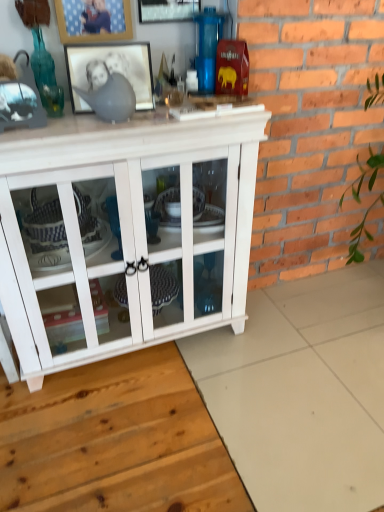
Question: From a real-world perspective, is metallic silver picture frame at upper center, which appears as the 1th picture frame when viewed from the top, positioned over white wood cabinet at center based on gravity?

Choices:
 (A) yes
 (B) no

Answer: (A)

Question: Considering the relative sizes of metallic silver picture frame at upper center, which appears as the 1th picture frame when viewed from the top, and white wood cabinet at center in the image provided, is metallic silver picture frame at upper center, which appears as the 1th picture frame when viewed from the top, taller than white wood cabinet at center?

Choices:
 (A) yes
 (B) no

Answer: (B)

Question: Is metallic silver picture frame at upper center, which appears as the 1th picture frame when viewed from the top, smaller than white wood cabinet at center?

Choices:
 (A) yes
 (B) no

Answer: (A)

Question: Does metallic silver picture frame at upper center, which appears as the 1th picture frame when viewed from the top, have a greater width compared to white wood cabinet at center?

Choices:
 (A) no
 (B) yes

Answer: (A)

Question: Is there a large distance between metallic silver picture frame at upper center, acting as the third picture frame starting from the bottom, and white wood cabinet at center?

Choices:
 (A) yes
 (B) no

Answer: (B)

Question: From the image's perspective, is white wood cabinet at center above or below black matte picture frame at upper center, which ranks as the 1th picture frame in bottom-to-top order?

Choices:
 (A) above
 (B) below

Answer: (B)

Question: In terms of size, does white wood cabinet at center appear bigger or smaller than black matte picture frame at upper center, which ranks as the 1th picture frame in bottom-to-top order?

Choices:
 (A) big
 (B) small

Answer: (A)

Question: Is point (210, 130) positioned closer to the camera than point (112, 49)?

Choices:
 (A) closer
 (B) farther

Answer: (A)

Question: Would you say white wood cabinet at center is inside or outside black matte picture frame at upper center, which ranks as the 1th picture frame in bottom-to-top order?

Choices:
 (A) inside
 (B) outside

Answer: (B)

Question: From a real-world perspective, is wooden picture frame at upper center, the second picture frame in the bottom-to-top sequence, above or below black matte picture frame at upper center, which is counted as the third picture frame, starting from the top?

Choices:
 (A) above
 (B) below

Answer: (A)

Question: Considering the positions of point (84, 34) and point (99, 45), is point (84, 34) closer or farther from the camera than point (99, 45)?

Choices:
 (A) closer
 (B) farther

Answer: (A)

Question: Do you think wooden picture frame at upper center, which ranks as the second picture frame in top-to-bottom order, is within black matte picture frame at upper center, which ranks as the 1th picture frame in bottom-to-top order, or outside of it?

Choices:
 (A) inside
 (B) outside

Answer: (B)

Question: Is wooden picture frame at upper center, which ranks as the second picture frame in top-to-bottom order, wider or thinner than black matte picture frame at upper center, which ranks as the 1th picture frame in bottom-to-top order?

Choices:
 (A) thin
 (B) wide

Answer: (A)

Question: From a real-world perspective, is wooden picture frame at upper center, the second picture frame in the bottom-to-top sequence, physically located above or below white wood cabinet at center?

Choices:
 (A) below
 (B) above

Answer: (B)

Question: From the image's perspective, relative to white wood cabinet at center, is wooden picture frame at upper center, which ranks as the second picture frame in top-to-bottom order, above or below?

Choices:
 (A) below
 (B) above

Answer: (B)